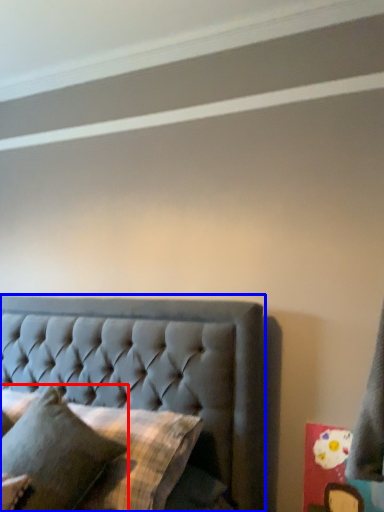
Question: Which of the following is the closest to the observer, pillow (highlighted by a red box) or bed (highlighted by a blue box)?

Choices:
 (A) pillow
 (B) bed

Answer: (A)